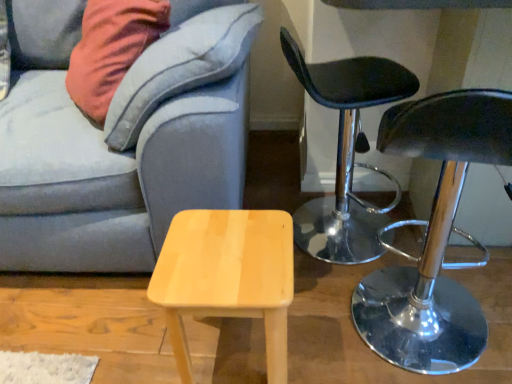
Question: From a real-world perspective, is shiny chrome stool at right, which ranks as the second chair in back-to-front order, on top of light wood stool at center?

Choices:
 (A) yes
 (B) no

Answer: (A)

Question: Is shiny chrome stool at right, which ranks as the second chair in back-to-front order, further to the viewer compared to light wood stool at center?

Choices:
 (A) no
 (B) yes

Answer: (A)

Question: Is shiny chrome stool at right, which is counted as the 1th chair, starting from the front, positioned beyond the bounds of light wood stool at center?

Choices:
 (A) no
 (B) yes

Answer: (B)

Question: Is shiny chrome stool at right, which ranks as the second chair in back-to-front order, turned away from light wood stool at center?

Choices:
 (A) yes
 (B) no

Answer: (B)

Question: Does shiny chrome stool at right, which ranks as the second chair in back-to-front order, appear on the left side of light wood stool at center?

Choices:
 (A) yes
 (B) no

Answer: (B)

Question: From the image's perspective, is shiny chrome stool at right, which ranks as the second chair in back-to-front order, located beneath light wood stool at center?

Choices:
 (A) yes
 (B) no

Answer: (B)

Question: Is velvet gray couch at lower left positioned far away from black leather stool at right, which is counted as the 2th chair, starting from the front?

Choices:
 (A) no
 (B) yes

Answer: (A)

Question: Considering the relative sizes of velvet gray couch at lower left and black leather stool at right, which ranks as the first chair in back-to-front order, in the image provided, is velvet gray couch at lower left taller than black leather stool at right, which ranks as the first chair in back-to-front order,?

Choices:
 (A) yes
 (B) no

Answer: (B)

Question: Could black leather stool at right, which is counted as the 2th chair, starting from the front, be considered to be inside velvet gray couch at lower left?

Choices:
 (A) yes
 (B) no

Answer: (B)

Question: Can you confirm if velvet gray couch at lower left is wider than black leather stool at right, which ranks as the first chair in back-to-front order?

Choices:
 (A) yes
 (B) no

Answer: (A)

Question: From a real-world perspective, is velvet gray couch at lower left over black leather stool at right, which ranks as the first chair in back-to-front order?

Choices:
 (A) yes
 (B) no

Answer: (A)

Question: Is velvet gray couch at lower left at the right side of black leather stool at right, which is counted as the 2th chair, starting from the front?

Choices:
 (A) yes
 (B) no

Answer: (B)

Question: Is black leather stool at right, which is counted as the 2th chair, starting from the front, to the left of shiny chrome stool at right, which is counted as the 1th chair, starting from the front, from the viewer's perspective?

Choices:
 (A) yes
 (B) no

Answer: (A)